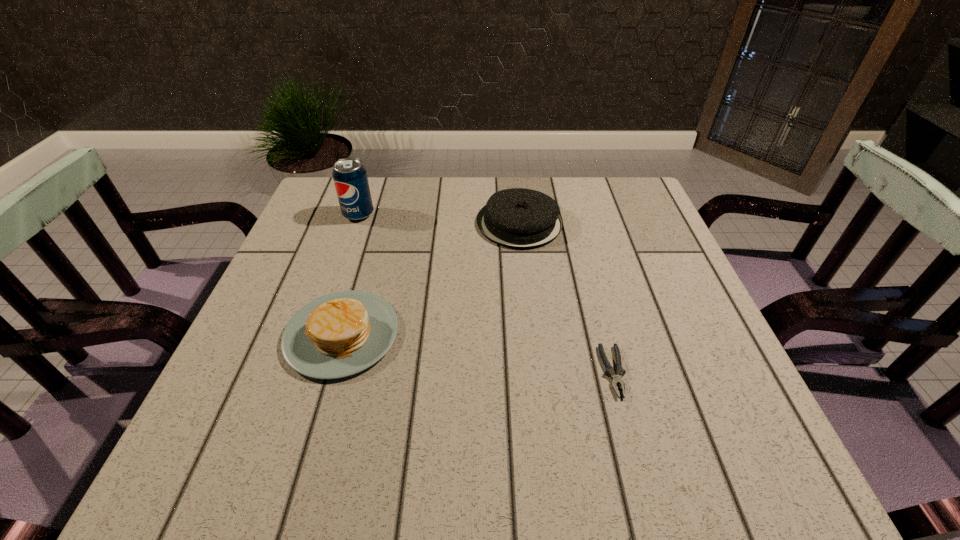
Locate an element on the screen. The height and width of the screenshot is (540, 960). the tallest object is located at coordinates (350, 178).

Where is `the second object from right to left`? the second object from right to left is located at coordinates (518, 218).

The width and height of the screenshot is (960, 540). I want to click on the right pancake, so (x=518, y=218).

Where is `the left pancake`? The width and height of the screenshot is (960, 540). the left pancake is located at coordinates (340, 334).

You are a GUI agent. You are given a task and a screenshot of the screen. Output one action in this format:
    pyautogui.click(x=<x>, y=<y>)
    Task: Click on the shortest object
    
    Given the screenshot: What is the action you would take?
    pyautogui.click(x=616, y=379)

Find the location of `pliers`. pliers is located at coordinates (616, 379).

Where is `vacant area situated 0.370m on the right of the tallest object`? vacant area situated 0.370m on the right of the tallest object is located at coordinates 514,214.

What are the coordinates of `vacant region located 0.370m on the left of the right pancake` in the screenshot? It's located at (333, 223).

Locate an element on the screen. The width and height of the screenshot is (960, 540). vacant space situated on the right of the left pancake is located at coordinates (449, 334).

Where is `vacant area situated at the gripping part of the rightmost object`? vacant area situated at the gripping part of the rightmost object is located at coordinates (639, 469).